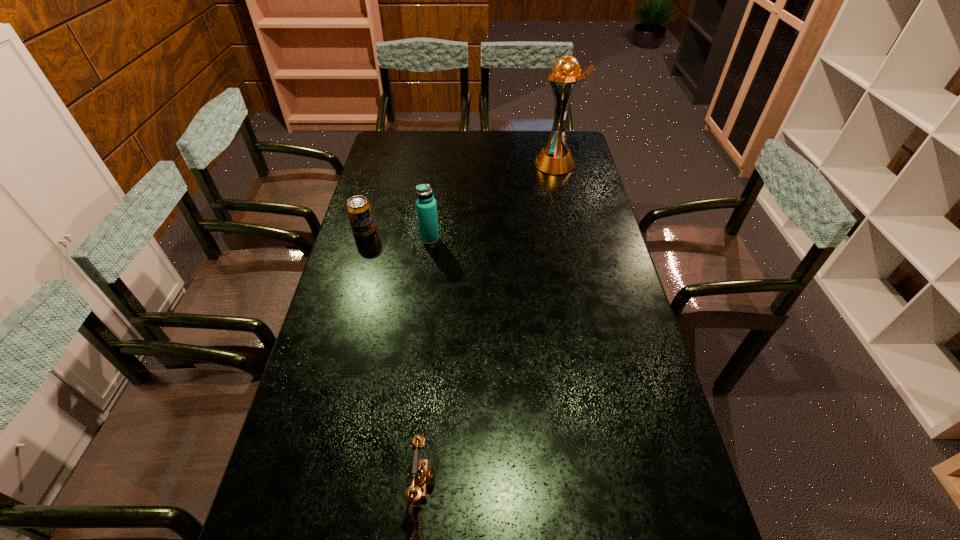
The height and width of the screenshot is (540, 960). Find the location of `the rightmost object`. the rightmost object is located at coordinates (555, 158).

In order to click on the farthest object in this screenshot , I will do pyautogui.click(x=555, y=158).

Where is `water bottle`? The image size is (960, 540). water bottle is located at coordinates (426, 206).

This screenshot has width=960, height=540. I want to click on soda can, so click(x=358, y=208).

Where is `free space located on the front-facing side of the farthest object`? This screenshot has height=540, width=960. free space located on the front-facing side of the farthest object is located at coordinates (476, 164).

What are the coordinates of `vacant space situated 0.070m on the front-facing side of the farthest object` in the screenshot? It's located at (518, 164).

In order to click on blank space located 0.350m on the front-facing side of the farthest object in this screenshot , I will do `click(453, 164)`.

The height and width of the screenshot is (540, 960). Identify the location of free space located on the left of the second tallest object. (406, 239).

Where is `vacant space situated 0.320m on the back of the leftmost object`? vacant space situated 0.320m on the back of the leftmost object is located at coordinates [x=380, y=176].

Image resolution: width=960 pixels, height=540 pixels. What are the coordinates of `object that is at the far edge` in the screenshot? It's located at (555, 158).